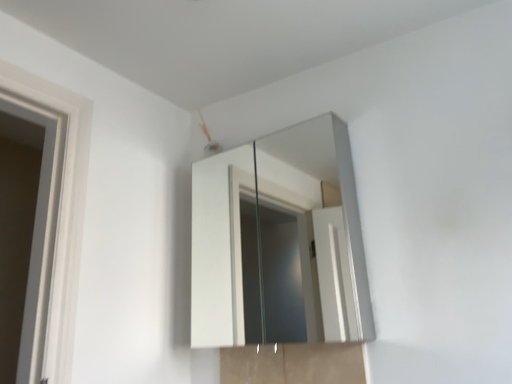
Question: Should I look upward or downward to see white glossy medicine cabinet at upper center?

Choices:
 (A) up
 (B) down

Answer: (B)